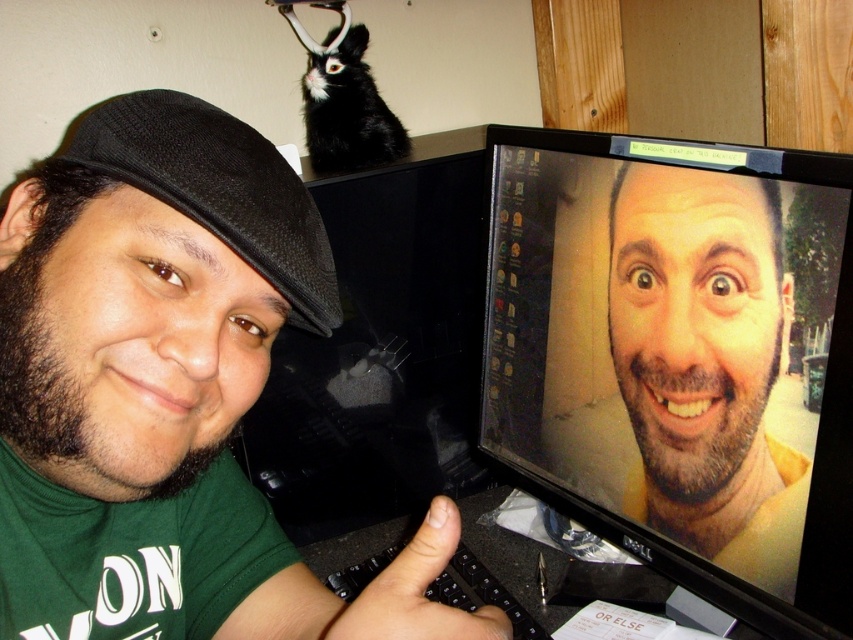
Question: Which of the following is the farthest from the observer?

Choices:
 (A) (625, 337)
 (B) (807, 380)
 (C) (144, 148)

Answer: (A)

Question: Does matte black monitor at center have a smaller size compared to smooth skin face at center?

Choices:
 (A) no
 (B) yes

Answer: (A)

Question: Estimate the real-world distances between objects in this image. Which object is closer to the matte black monitor at center?

Choices:
 (A) smooth skin face at center
 (B) black fabric hat at left
 (C) green matte shirt at left
 (D) green matte shirt at center

Answer: (A)

Question: Can you confirm if green matte shirt at left is smaller than black fabric hat at left?

Choices:
 (A) yes
 (B) no

Answer: (A)

Question: Is green matte shirt at left to the right of black fabric hat at left from the viewer's perspective?

Choices:
 (A) no
 (B) yes

Answer: (A)

Question: Considering the real-world distances, which object is closest to the black fabric hat at left?

Choices:
 (A) smooth skin face at center
 (B) green matte shirt at center

Answer: (B)